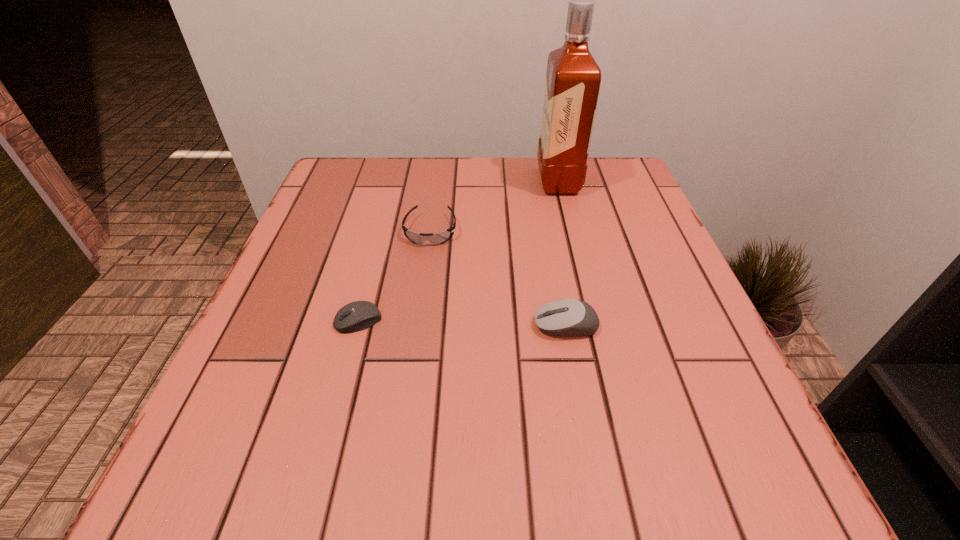
At what (x,y) coordinates should I click in order to perform the action: click on vacant area that lies between the second tallest object and the farthest object. Please return your answer as a coordinate pair (x, y). This screenshot has height=540, width=960. Looking at the image, I should click on (562, 253).

This screenshot has height=540, width=960. In order to click on free space between the liquor and the leftmost object in this screenshot , I will do [458, 251].

This screenshot has width=960, height=540. What are the coordinates of `empty space that is in between the farthest object and the right computer equipment` in the screenshot? It's located at (562, 253).

The width and height of the screenshot is (960, 540). What are the coordinates of `blank region between the taller computer equipment and the farthest object` in the screenshot? It's located at (562, 253).

The height and width of the screenshot is (540, 960). I want to click on free space between the liquor and the third shortest object, so click(562, 253).

The image size is (960, 540). Identify the location of vacant point located between the left computer equipment and the sunglasses. (395, 275).

Where is `free spot between the liquor and the shorter computer equipment`? free spot between the liquor and the shorter computer equipment is located at coordinates (458, 251).

Where is `free point between the right computer equipment and the third object from right to left`? The height and width of the screenshot is (540, 960). free point between the right computer equipment and the third object from right to left is located at coordinates (498, 278).

Select which object is the third closest to the farthest object. Please provide its 2D coordinates. Your answer should be formatted as a tuple, i.e. [(x, y)], where the tuple contains the x and y coordinates of a point satisfying the conditions above.

[(359, 315)]

You are a GUI agent. You are given a task and a screenshot of the screen. Output one action in this format:
    pyautogui.click(x=<x>, y=<y>)
    Task: Click on the object that is the nearest to the sunglasses
    
    Given the screenshot: What is the action you would take?
    pyautogui.click(x=359, y=315)